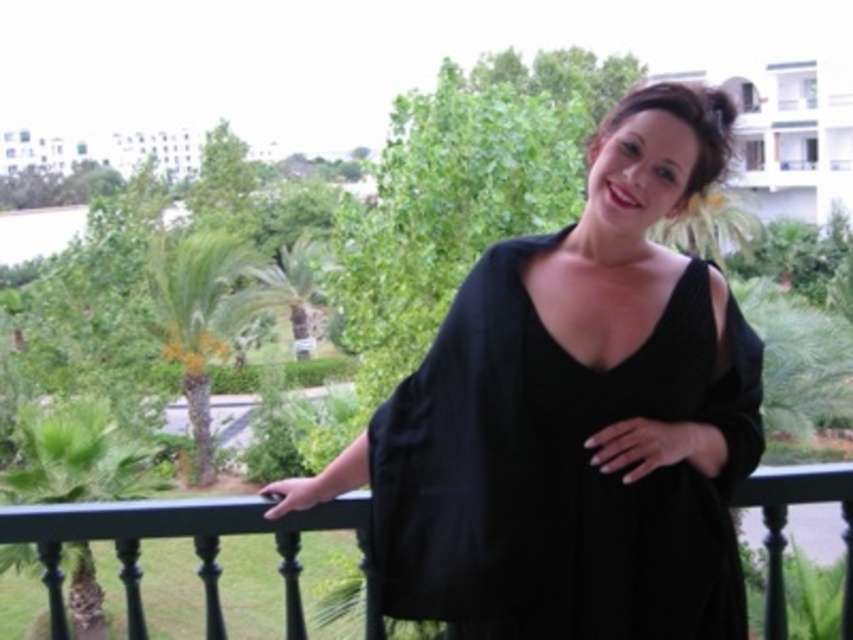
Which is more to the left, black matte dress at center or black painted wood at center?

black painted wood at center

Which is more to the right, black matte dress at center or black painted wood at center?

Positioned to the right is black matte dress at center.

Who is more distant from viewer, (444, 324) or (51, 552)?

The point (444, 324) is more distant.

The height and width of the screenshot is (640, 853). I want to click on black matte dress at center, so 575,417.

Who is more forward, [131,563] or [784,124]?

Point [131,563]

What do you see at coordinates (193, 547) in the screenshot?
I see `black painted wood at center` at bounding box center [193, 547].

Where is `black painted wood at center`? black painted wood at center is located at coordinates (193, 547).

Between point (485, 426) and point (795, 176), which one is positioned in front?

Point (485, 426) is in front.

Is black matte dress at center closer to camera compared to black fabric balcony at upper right?

Yes, it is in front of black fabric balcony at upper right.

You are a GUI agent. You are given a task and a screenshot of the screen. Output one action in this format:
    pyautogui.click(x=<x>, y=<y>)
    Task: Click on the black matte dress at center
    Image resolution: width=853 pixels, height=640 pixels.
    Given the screenshot: What is the action you would take?
    pyautogui.click(x=575, y=417)

You are a GUI agent. You are given a task and a screenshot of the screen. Output one action in this format:
    pyautogui.click(x=<x>, y=<y>)
    Task: Click on the black matte dress at center
    This screenshot has height=640, width=853.
    Given the screenshot: What is the action you would take?
    pyautogui.click(x=575, y=417)